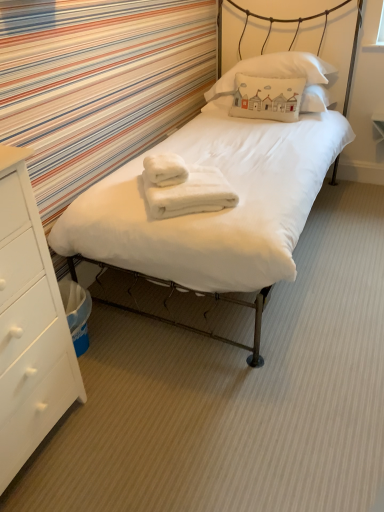
Identify the location of unoccupied area in front of white soft towel at center, which ranks as the 1th bath towel in left-to-right order. This screenshot has height=512, width=384. (185, 187).